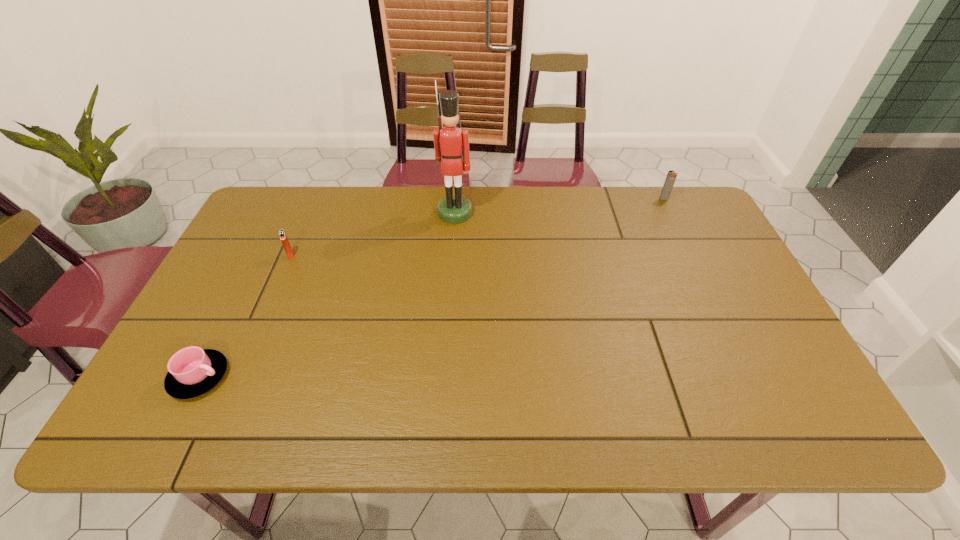
At what (x,y) coordinates should I click in order to perform the action: click on the tallest object. Please return your answer as a coordinate pair (x, y). Image resolution: width=960 pixels, height=540 pixels. Looking at the image, I should click on (448, 140).

Where is `nutcracker`? This screenshot has width=960, height=540. nutcracker is located at coordinates (448, 140).

This screenshot has height=540, width=960. In order to click on the farthest object in this screenshot , I will do `click(669, 182)`.

At what (x,y) coordinates should I click in order to perform the action: click on the farther igniter. Please return your answer as a coordinate pair (x, y). Looking at the image, I should click on (669, 182).

Identify the location of the third tallest object. The image size is (960, 540). (282, 234).

You are a GUI agent. You are given a task and a screenshot of the screen. Output one action in this format:
    pyautogui.click(x=<x>, y=<y>)
    Task: Click on the left igniter
    
    Given the screenshot: What is the action you would take?
    pyautogui.click(x=282, y=234)

You are a GUI agent. You are given a task and a screenshot of the screen. Output one action in this format:
    pyautogui.click(x=<x>, y=<y>)
    Task: Click on the nearest object
    
    Given the screenshot: What is the action you would take?
    pyautogui.click(x=192, y=371)

At what (x,y) coordinates should I click in order to perform the action: click on the leftmost object. Please return your answer as a coordinate pair (x, y). The width and height of the screenshot is (960, 540). Looking at the image, I should click on (192, 371).

This screenshot has width=960, height=540. Identify the location of free region located 0.210m on the front-facing side of the tallest object. tap(451, 272).

I want to click on vacant space located 0.060m on the left of the rightmost object, so click(x=641, y=199).